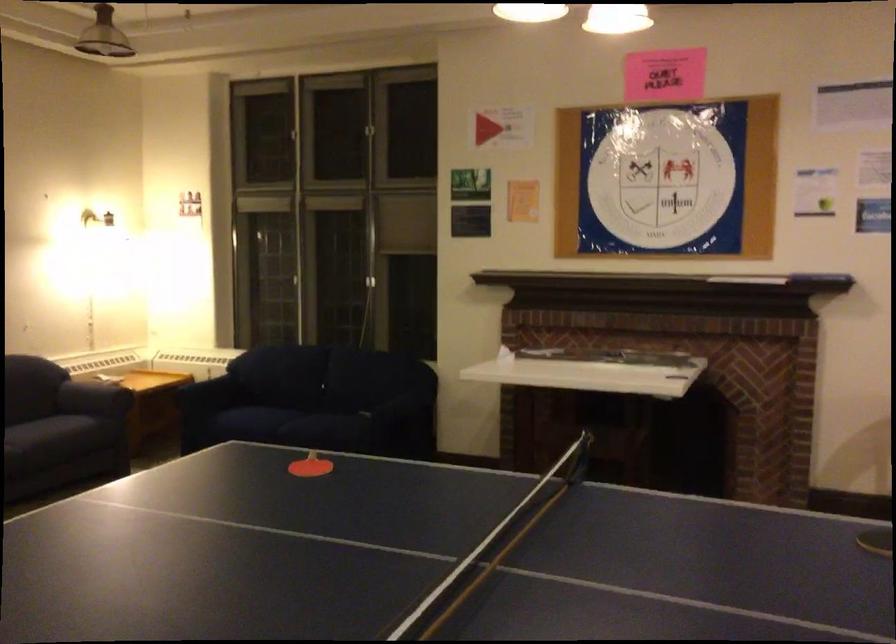
At what (x,y) coordinates should I click in order to perform the action: click on blue sofa sitting surface. Please return your answer as a coordinate pair (x, y). The height and width of the screenshot is (644, 896). Looking at the image, I should click on pos(271,424).